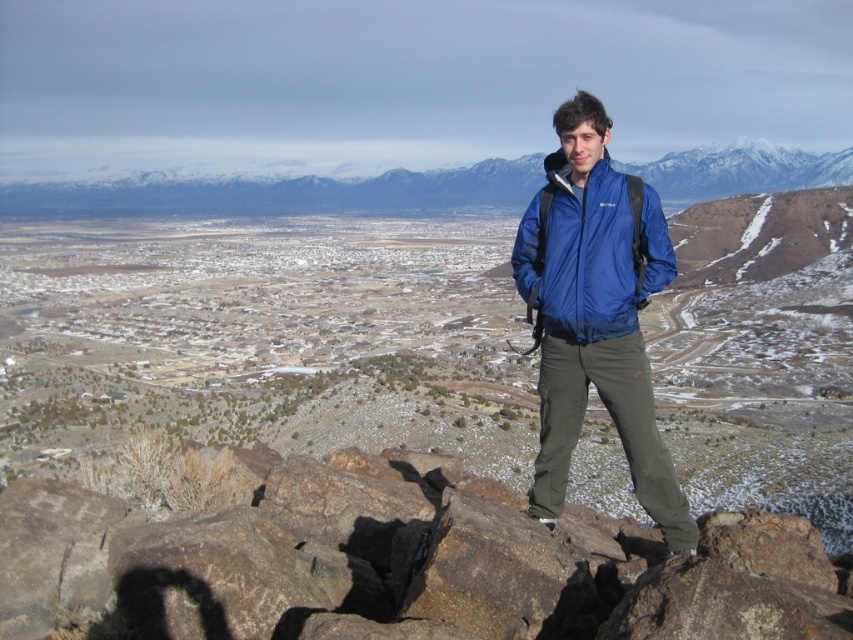
You are a drone operator tasked with capturing a closeup shot of the blue fabric jacket at center. The drone is currently at a position above the rocky outcrop. According to the coordinates provided, is the jacket positioned closer to the top or bottom half of the image?

The blue fabric jacket at center is located at point (596, 314). Since the y coordinate is 0.700, which is above the midpoint of 0.5, the jacket is positioned closer to the top half of the image.

You are a drone operator trying to capture the best aerial shot of the scene. You have two points marked on your map, point A at coordinates point (135,516) and point B at coordinates point (563,330). Which point should you fly towards first to ensure you capture the hiker and the cityscape in your shot?

Point point (135,516) is closer to the viewer than point point (563,330), so you should fly towards point point (135,516) first to capture the hiker and cityscape in your shot.

You are a photographer trying to capture the hiker in the image. To ensure the blue fabric jacket at center stands out against the brown rough rock at center, which object should be placed to the right of the jacket?

The brown rough rock at center is positioned on the left side of blue fabric jacket at center, so to make the jacket stand out, place the rock to the right of the jacket.